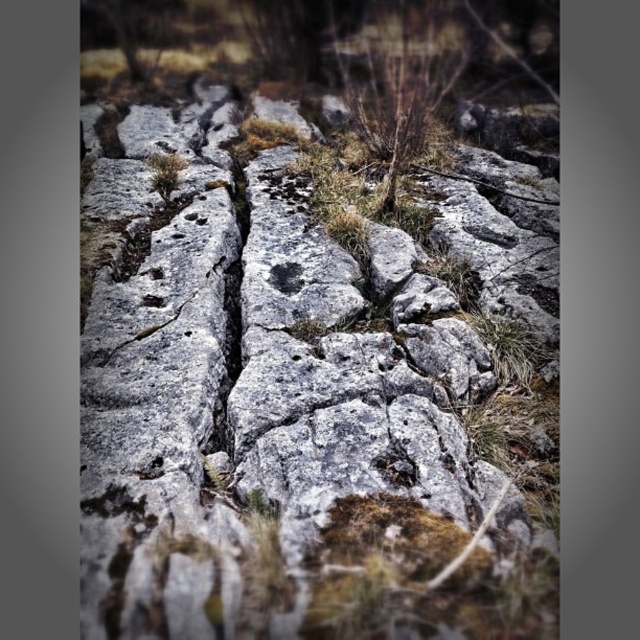
You are a geologist examining the rocky terrain in the image. You need to determine which of the two points, point (160, 154) or point (298, 269), is closer to you. Can you identify which one is nearer based on the scene?

Point (160, 154) is closer to you than point (298, 269) because it is further to the viewer in the image.

You are standing at the point marked by the coordinates point (291,404) in the rocky terrain. What type of surface are you currently on?

The point (291,404) marks gray rough rock at center, so you are standing on a gray rough rock surface.

You are a geologist examining the rocky terrain. You need to collect samples from both the gray rough rock at center and the green mossy rock at upper center. Which rock should you climb up to reach first?

You should climb up to the green mossy rock at upper center first because it is located above the gray rough rock at center.